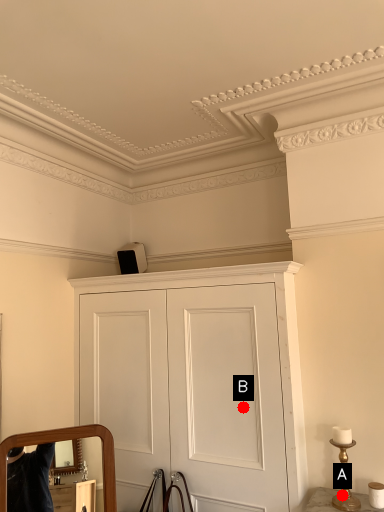
Question: Two points are circled on the image, labeled by A and B beside each circle. Which point is farther to the camera?

Choices:
 (A) A is further
 (B) B is further

Answer: (B)